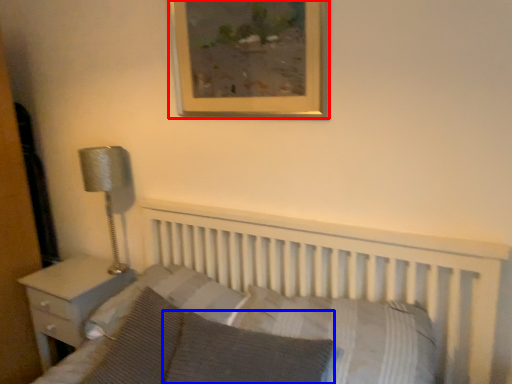
Question: Among these objects, which one is nearest to the camera, picture frame (highlighted by a red box) or pillow (highlighted by a blue box)?

Choices:
 (A) picture frame
 (B) pillow

Answer: (B)